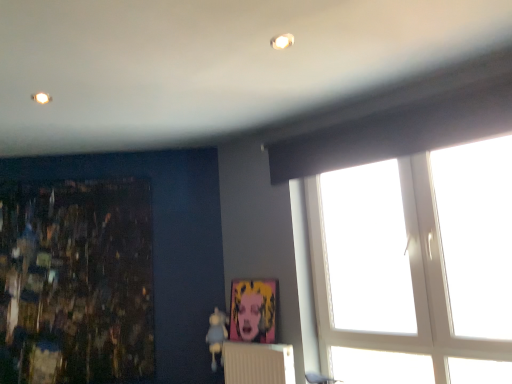
Question: Should I look upward or downward to see white textured radiator at lower center?

Choices:
 (A) up
 (B) down

Answer: (B)

Question: Is dark textured painting at left positioned in front of white textured radiator at lower center?

Choices:
 (A) no
 (B) yes

Answer: (A)

Question: Can you confirm if dark textured painting at left is taller than white textured radiator at lower center?

Choices:
 (A) yes
 (B) no

Answer: (A)

Question: Considering the relative sizes of dark textured painting at left and white textured radiator at lower center in the image provided, is dark textured painting at left smaller than white textured radiator at lower center?

Choices:
 (A) yes
 (B) no

Answer: (B)

Question: Is dark textured painting at left to the left of white textured radiator at lower center from the viewer's perspective?

Choices:
 (A) yes
 (B) no

Answer: (A)

Question: Considering the relative positions of dark textured painting at left and white textured radiator at lower center in the image provided, is dark textured painting at left to the right of white textured radiator at lower center from the viewer's perspective?

Choices:
 (A) no
 (B) yes

Answer: (A)

Question: From the image's perspective, is dark textured painting at left located beneath white textured radiator at lower center?

Choices:
 (A) no
 (B) yes

Answer: (A)

Question: Is white textured radiator at lower center next to matte plastic picture frame at center and touching it?

Choices:
 (A) no
 (B) yes

Answer: (A)

Question: Can you confirm if white textured radiator at lower center is thinner than matte plastic picture frame at center?

Choices:
 (A) no
 (B) yes

Answer: (A)

Question: Is there a large distance between white textured radiator at lower center and matte plastic picture frame at center?

Choices:
 (A) yes
 (B) no

Answer: (B)

Question: From the image's perspective, is white textured radiator at lower center under matte plastic picture frame at center?

Choices:
 (A) yes
 (B) no

Answer: (A)

Question: Can we say white textured radiator at lower center lies outside matte plastic picture frame at center?

Choices:
 (A) yes
 (B) no

Answer: (A)

Question: From a real-world perspective, is white textured radiator at lower center physically below matte plastic picture frame at center?

Choices:
 (A) no
 (B) yes

Answer: (B)

Question: Does dark textured painting at left have a lesser width compared to matte plastic picture frame at center?

Choices:
 (A) yes
 (B) no

Answer: (A)